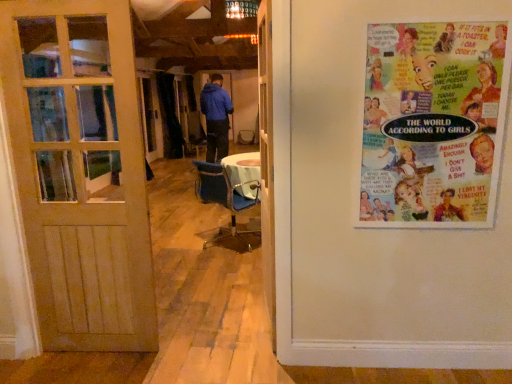
Question: Considering the positions of white wooden door at center, acting as the 2th door starting from the left, and blue fabric chair at center in the image, is white wooden door at center, acting as the 2th door starting from the left, wider or thinner than blue fabric chair at center?

Choices:
 (A) thin
 (B) wide

Answer: (A)

Question: Considering the positions of white wooden door at center, acting as the 2th door starting from the left, and blue fabric chair at center in the image, is white wooden door at center, acting as the 2th door starting from the left, taller or shorter than blue fabric chair at center?

Choices:
 (A) tall
 (B) short

Answer: (A)

Question: Estimate the real-world distances between objects in this image. Which object is closer to the blue fabric chair at center?

Choices:
 (A) white wooden door at center, the first door from the right
 (B) colorful paper poster at upper right
 (C) wooden door at left, which is the 1th door in left-to-right order

Answer: (A)

Question: Which object is positioned farthest from the wooden door at left, placed as the second door when sorted from right to left?

Choices:
 (A) white wooden door at center, the first door from the right
 (B) blue fabric chair at center
 (C) colorful paper poster at upper right

Answer: (B)